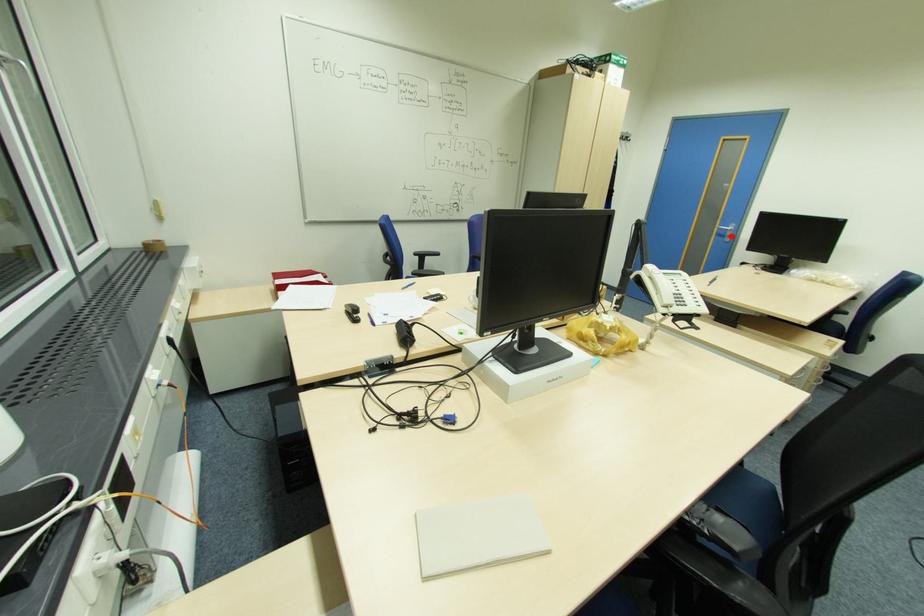
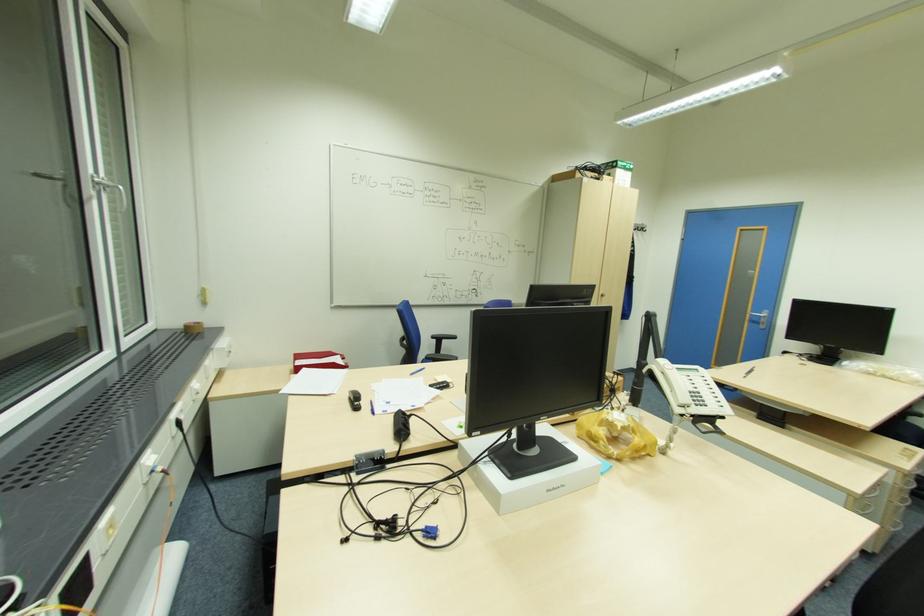
Where in the second image is the point corresponding to the highlighted location from the first image?

(766, 323)